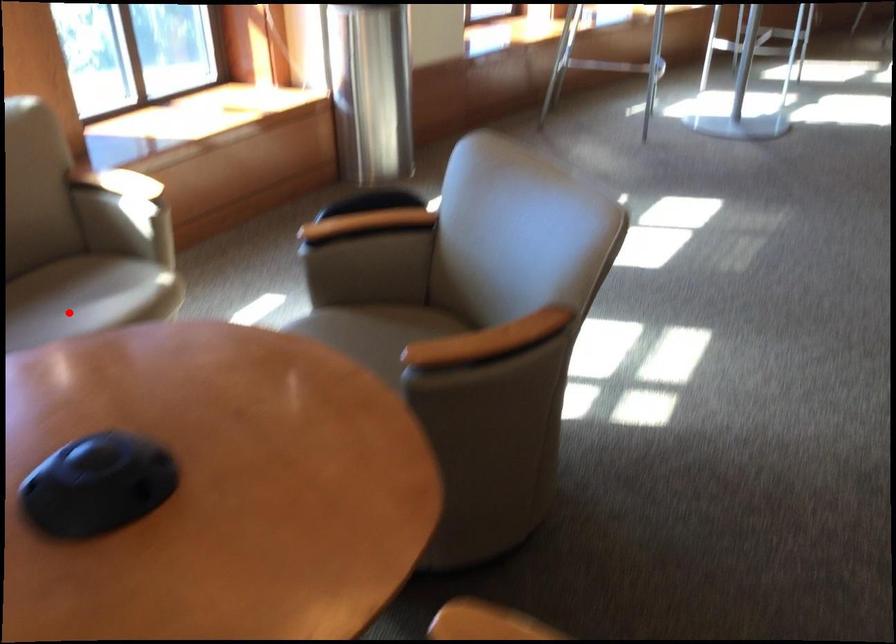
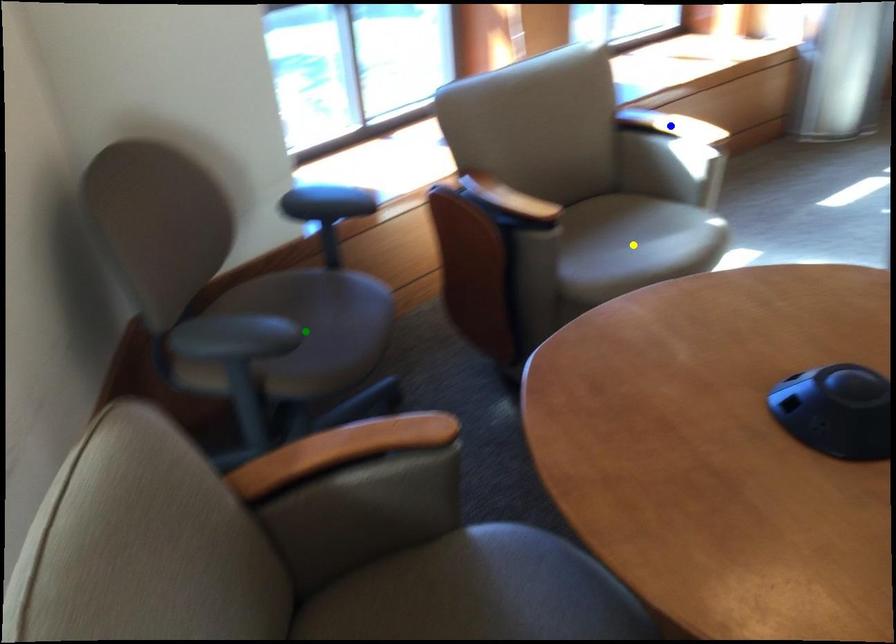
Question: I am providing you with two images of the same scene from different viewpoints. A red point is marked on the first image. You are given multiple points on the second image. Which point in image 2 is actually the same real-world point as the red point in image 1?

Choices:
 (A) blue point
 (B) yellow point
 (C) green point

Answer: (B)